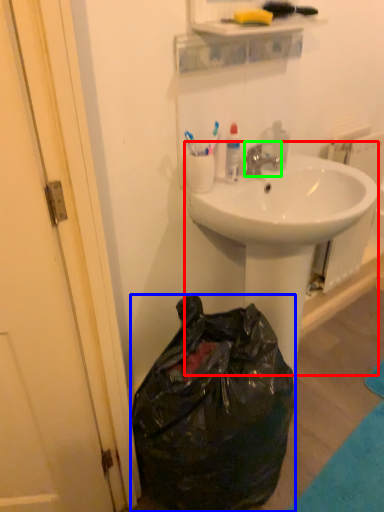
Question: Which is nearer to the sink (highlighted by a red box)? trash bin/can (highlighted by a blue box) or faucet (highlighted by a green box).

Choices:
 (A) trash bin/can
 (B) faucet

Answer: (B)